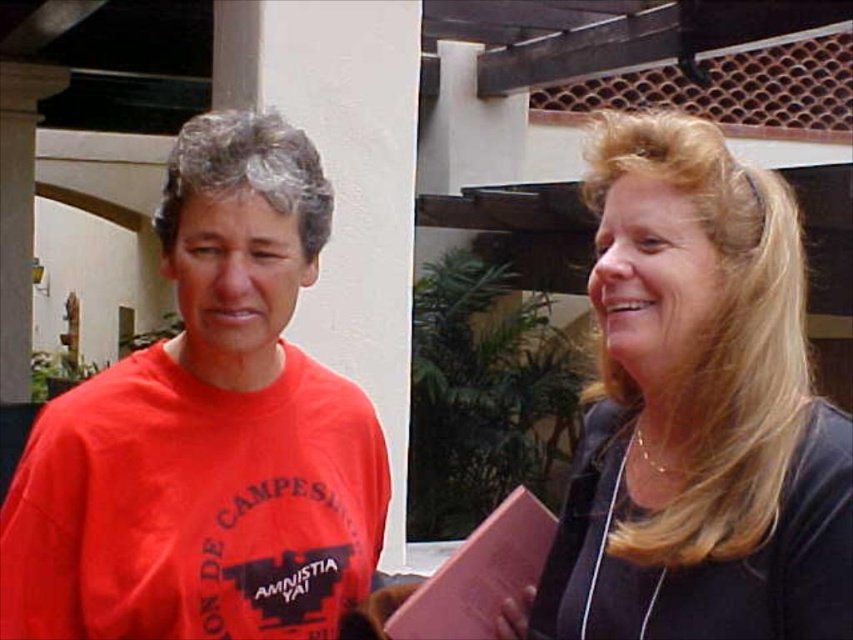
Can you confirm if matte red t-shirt at left is positioned to the right of smooth black shirt at right?

Incorrect, matte red t-shirt at left is not on the right side of smooth black shirt at right.

Which is behind, point (329, 412) or point (701, 172)?

The point (329, 412) is behind.

At what (x,y) coordinates should I click in order to perform the action: click on matte red t-shirt at left. Please return your answer as a coordinate pair (x, y). Looking at the image, I should click on (207, 432).